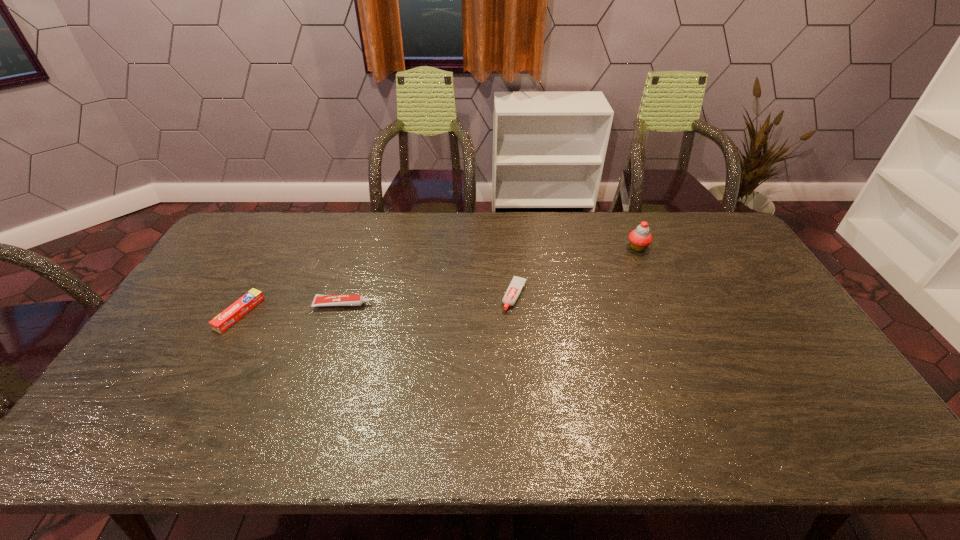
Locate an element on the screen. Image resolution: width=960 pixels, height=540 pixels. free location that satisfies the following two spatial constraints: 1. at the nozzle of the second toothpaste from right to left; 2. on the front side of the leftmost toothpaste is located at coordinates (340, 313).

Locate an element on the screen. This screenshot has width=960, height=540. free space in the image that satisfies the following two spatial constraints: 1. on the back side of the leftmost object; 2. on the right side of the farthest object is located at coordinates (276, 247).